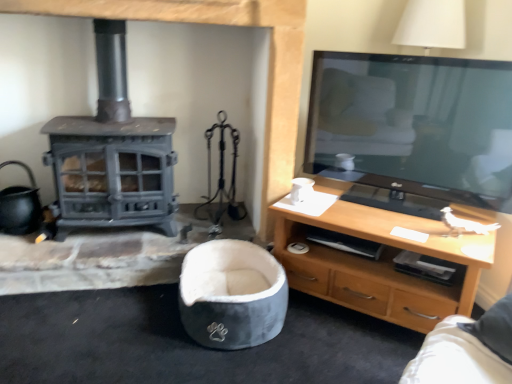
Question: Considering the relative sizes of light wood/finish tv stand at right and velvet grey bean bag chair at center in the image provided, is light wood/finish tv stand at right shorter than velvet grey bean bag chair at center?

Choices:
 (A) yes
 (B) no

Answer: (B)

Question: Does light wood/finish tv stand at right touch velvet grey bean bag chair at center?

Choices:
 (A) no
 (B) yes

Answer: (A)

Question: Does light wood/finish tv stand at right have a larger size compared to velvet grey bean bag chair at center?

Choices:
 (A) yes
 (B) no

Answer: (A)

Question: From a real-world perspective, is light wood/finish tv stand at right below velvet grey bean bag chair at center?

Choices:
 (A) yes
 (B) no

Answer: (B)

Question: Is velvet grey bean bag chair at center a part of light wood/finish tv stand at right?

Choices:
 (A) yes
 (B) no

Answer: (B)

Question: Is light wood/finish tv stand at right facing away from velvet grey bean bag chair at center?

Choices:
 (A) no
 (B) yes

Answer: (A)

Question: Is velvet grey bean bag chair at center aimed at light wood/finish tv stand at right?

Choices:
 (A) yes
 (B) no

Answer: (B)

Question: Is velvet grey bean bag chair at center positioned before light wood/finish tv stand at right?

Choices:
 (A) yes
 (B) no

Answer: (B)

Question: From the image's perspective, is velvet grey bean bag chair at center on light wood/finish tv stand at right?

Choices:
 (A) no
 (B) yes

Answer: (A)

Question: From a real-world perspective, is velvet grey bean bag chair at center located higher than light wood/finish tv stand at right?

Choices:
 (A) yes
 (B) no

Answer: (B)

Question: Is velvet grey bean bag chair at center at the right side of light wood/finish tv stand at right?

Choices:
 (A) no
 (B) yes

Answer: (A)

Question: Is velvet grey bean bag chair at center positioned far away from light wood/finish tv stand at right?

Choices:
 (A) no
 (B) yes

Answer: (A)

Question: Visually, is velvet grey bean bag chair at center positioned to the left or to the right of light wood/finish tv stand at right?

Choices:
 (A) left
 (B) right

Answer: (A)